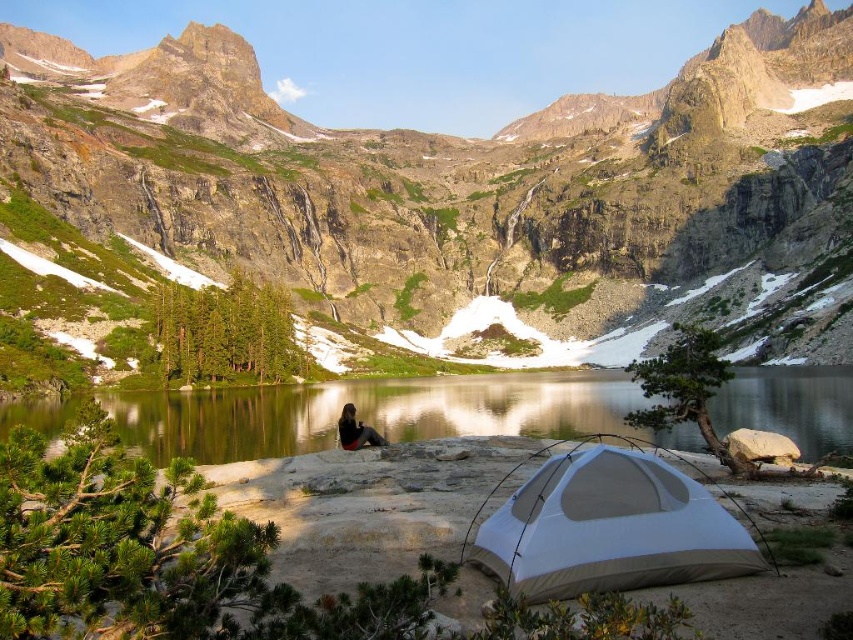
Consider the image. Who is more distant from viewer, (462, 403) or (616, 513)?

Point (462, 403)

Between clear glass water at center and white fabric tent at lower right, which one appears on the right side from the viewer's perspective?

white fabric tent at lower right

The height and width of the screenshot is (640, 853). Identify the location of clear glass water at center. (378, 413).

Locate an element on the screen. clear glass water at center is located at coordinates (378, 413).

Is point (627, 529) positioned before point (345, 416)?

Yes, it is in front of point (345, 416).

Does white fabric tent at lower right have a lesser width compared to black fabric person at center?

No.

Which is behind, point (613, 580) or point (369, 429)?

Point (369, 429)

Find the location of `white fabric tent at lower right`. white fabric tent at lower right is located at coordinates (610, 529).

Does point (405, 419) come closer to viewer compared to point (351, 442)?

That is False.

Between point (26, 417) and point (376, 444), which one is positioned behind?

The point (26, 417) is behind.

You are a GUI agent. You are given a task and a screenshot of the screen. Output one action in this format:
    pyautogui.click(x=<x>, y=<y>)
    Task: Click on the clear glass water at center
    The image size is (853, 640).
    Given the screenshot: What is the action you would take?
    pyautogui.click(x=378, y=413)